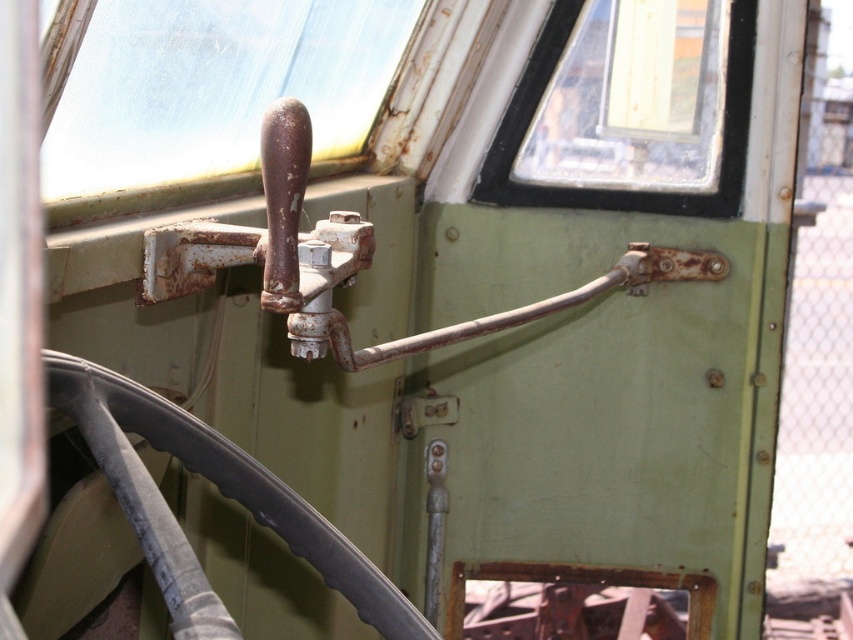
Locate an element on the screen. transparent plastic handle at upper center is located at coordinates (215, 86).

Locate an element on the screen. The height and width of the screenshot is (640, 853). transparent plastic handle at upper center is located at coordinates (215, 86).

Does rusty metal handle at center have a greater width compared to transparent glass window at upper center?

Yes.

Identify the location of rusty metal handle at center. The image size is (853, 640). (349, 260).

The image size is (853, 640). Identify the location of rusty metal handle at center. (349, 260).

Does transparent plastic handle at upper center come in front of rusty metal handle at center?

No, transparent plastic handle at upper center is further to the viewer.

Is point (207, 0) behind point (196, 272)?

That is True.

Which is behind, point (161, 26) or point (415, 333)?

Positioned behind is point (415, 333).

Find the location of `transparent plastic handle at upper center`. transparent plastic handle at upper center is located at coordinates (x=215, y=86).